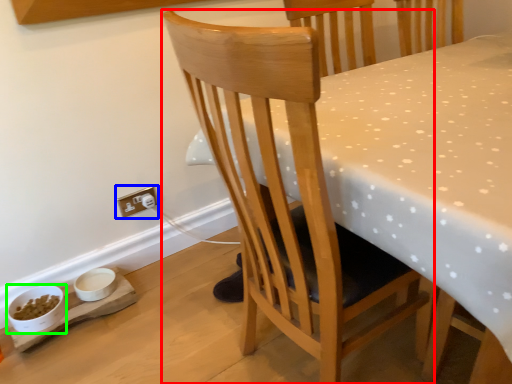
Question: Which object is positioned closest to chair (highlighted by a red box)? Select from electric outlet (highlighted by a blue box) and bowl (highlighted by a green box).

Choices:
 (A) electric outlet
 (B) bowl

Answer: (A)